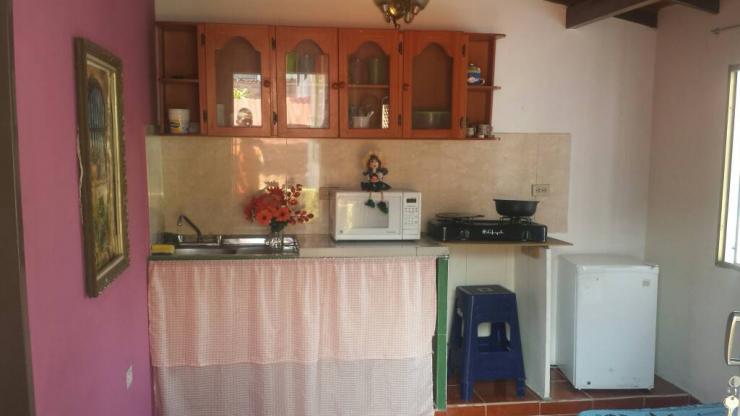
Locate an element on the screen. wall is located at coordinates (547, 87).